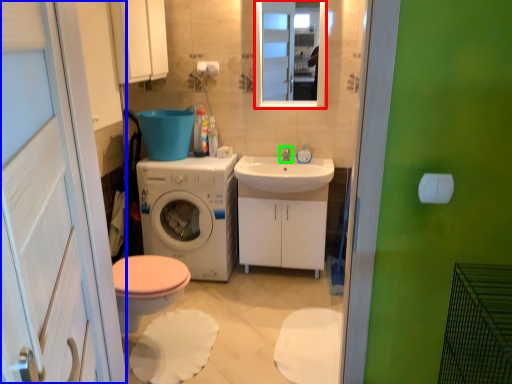
Question: Estimate the real-world distances between objects in this image. Which object is closer to mirror (highlighted by a red box), screen door (highlighted by a blue box) or tap (highlighted by a green box)?

Choices:
 (A) screen door
 (B) tap

Answer: (B)